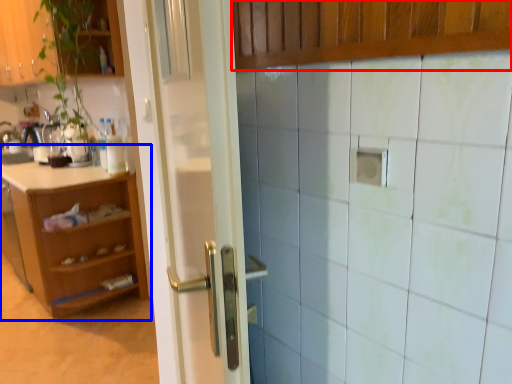
Question: Which object appears closest to the camera in this image, cabinetry (highlighted by a red box) or cabinetry (highlighted by a blue box)?

Choices:
 (A) cabinetry
 (B) cabinetry

Answer: (A)